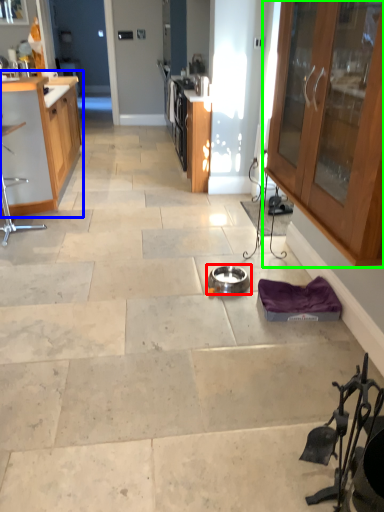
Question: Which object is the farthest from appliance (highlighted by a red box)? Choose among these: cabinetry (highlighted by a blue box) or cabinetry (highlighted by a green box).

Choices:
 (A) cabinetry
 (B) cabinetry

Answer: (A)